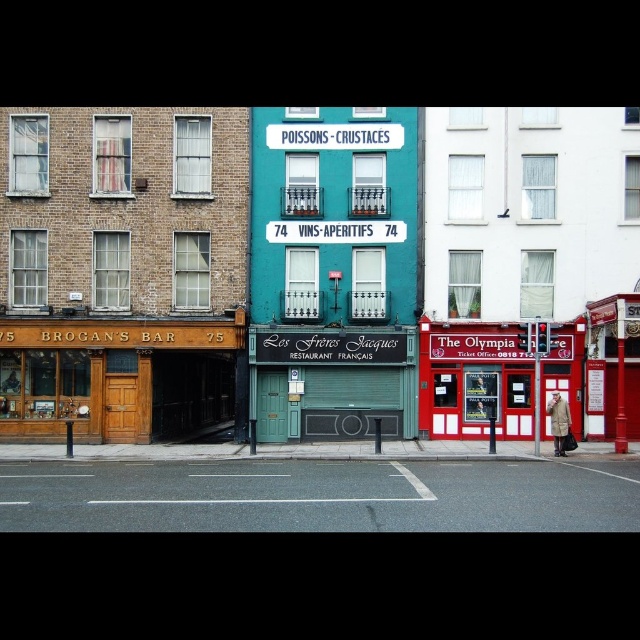
Which is more to the right, teal painted signboard at center or red painted metal ticket booth at center?

Positioned to the right is red painted metal ticket booth at center.

Who is shorter, teal painted signboard at center or red painted metal ticket booth at center?

With less height is teal painted signboard at center.

Who is more forward, (337, 278) or (464, 417)?

Point (464, 417) is more forward.

Where is `teal painted signboard at center`? teal painted signboard at center is located at coordinates (333, 269).